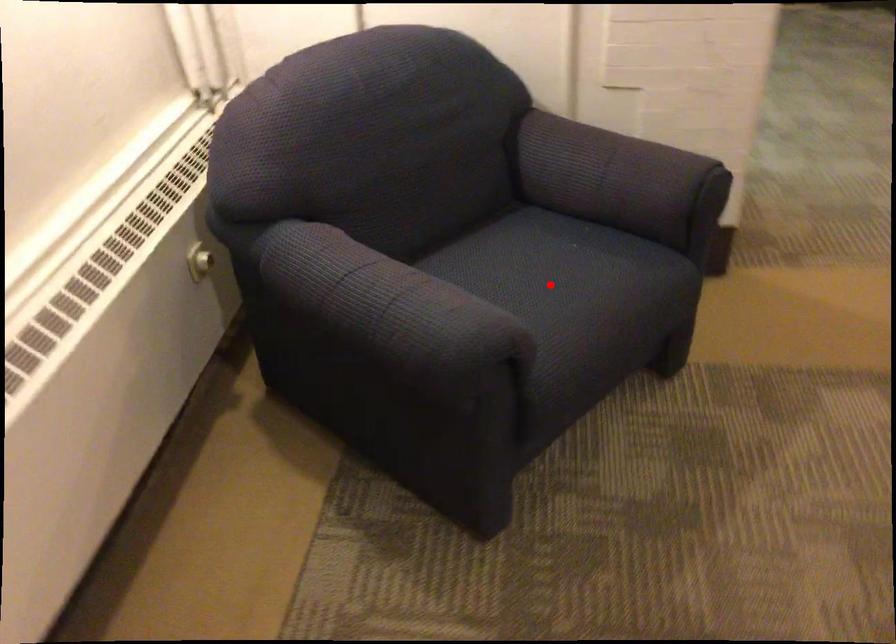
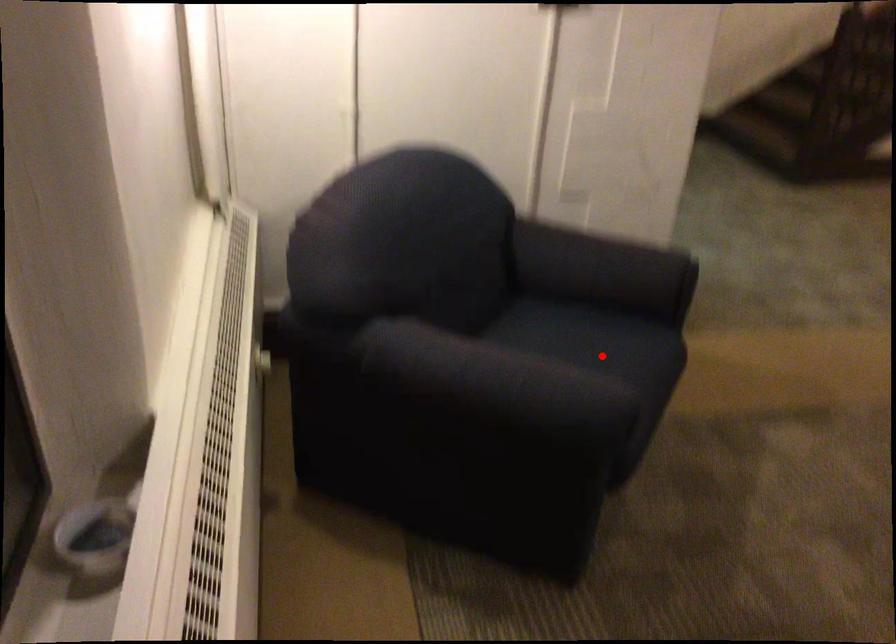
I am providing you with two images of the same scene from different viewpoints. A red point is marked on the first image and another point is marked on the second image. Is the marked point in image1 the same physical position as the marked point in image2?

Yes